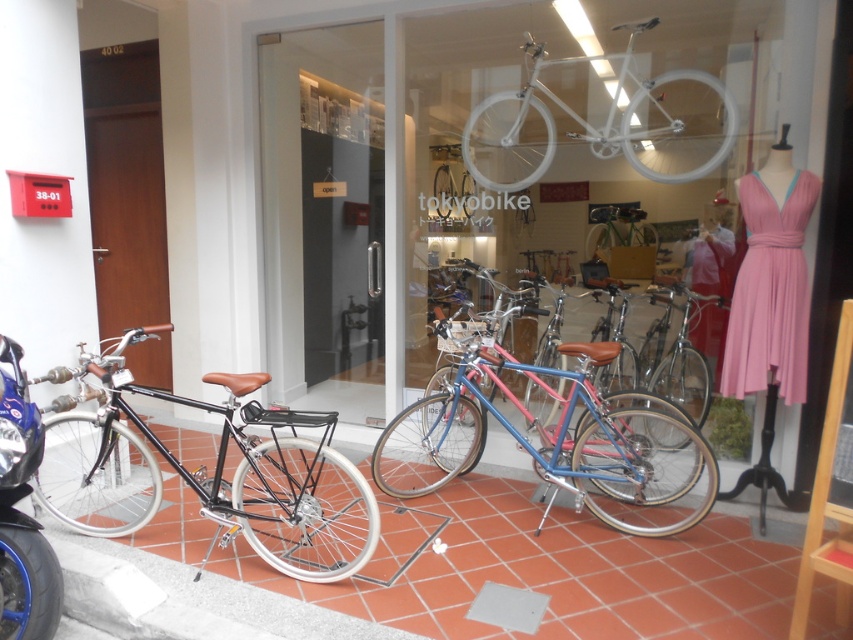
Question: Which point is closer to the camera?

Choices:
 (A) (428, 412)
 (B) (700, 173)

Answer: (B)

Question: Which point is farther from the camera taking this photo?

Choices:
 (A) (318, 556)
 (B) (192, 460)
 (C) (651, 83)
 (D) (660, 436)

Answer: (B)

Question: Which object appears farthest from the camera in this image?

Choices:
 (A) white matte bicycle at upper center
 (B) terracotta tile pavement at lower center
 (C) matte black bicycle at left

Answer: (A)

Question: Can you confirm if matte black bicycle at left is positioned to the left of blue metallic bicycle at center?

Choices:
 (A) yes
 (B) no

Answer: (A)

Question: Is blue metallic bicycle at center closer to camera compared to white matte bicycle at upper center?

Choices:
 (A) yes
 (B) no

Answer: (A)

Question: Can you confirm if matte black bicycle at left is bigger than blue metallic bicycle at center?

Choices:
 (A) no
 (B) yes

Answer: (B)